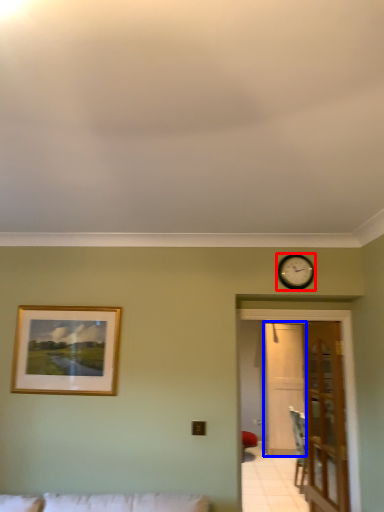
Question: Which object is closer to the camera taking this photo, wall clock (highlighted by a red box) or glass door (highlighted by a blue box)?

Choices:
 (A) wall clock
 (B) glass door

Answer: (A)